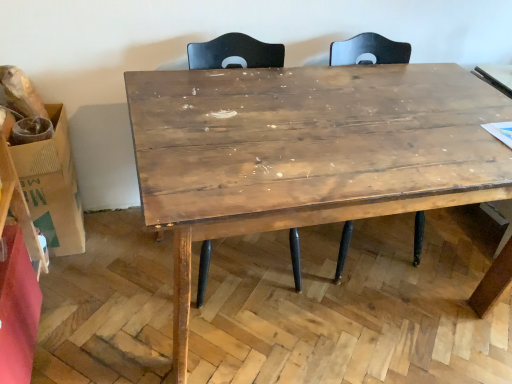
Question: From a real-world perspective, relative to brown cardboard box at left, is wooden table at center vertically above or below?

Choices:
 (A) above
 (B) below

Answer: (A)

Question: Considering the relative positions of wooden table at center and brown cardboard box at left in the image provided, is wooden table at center to the left or to the right of brown cardboard box at left?

Choices:
 (A) right
 (B) left

Answer: (A)

Question: Estimate the real-world distances between objects in this image. Which object is closer to the matte wood swivel chair at center?

Choices:
 (A) brown cardboard box at left
 (B) wooden table at center

Answer: (B)

Question: Estimate the real-world distances between objects in this image. Which object is closer to the brown cardboard box at left?

Choices:
 (A) wooden table at center
 (B) matte wood swivel chair at center

Answer: (B)